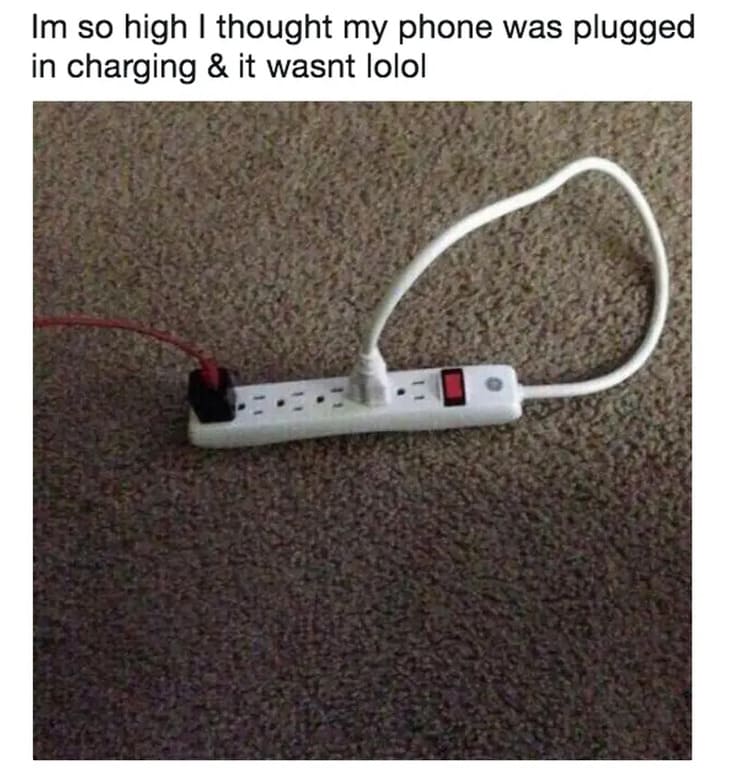
Identify the location of cord. (599, 384).